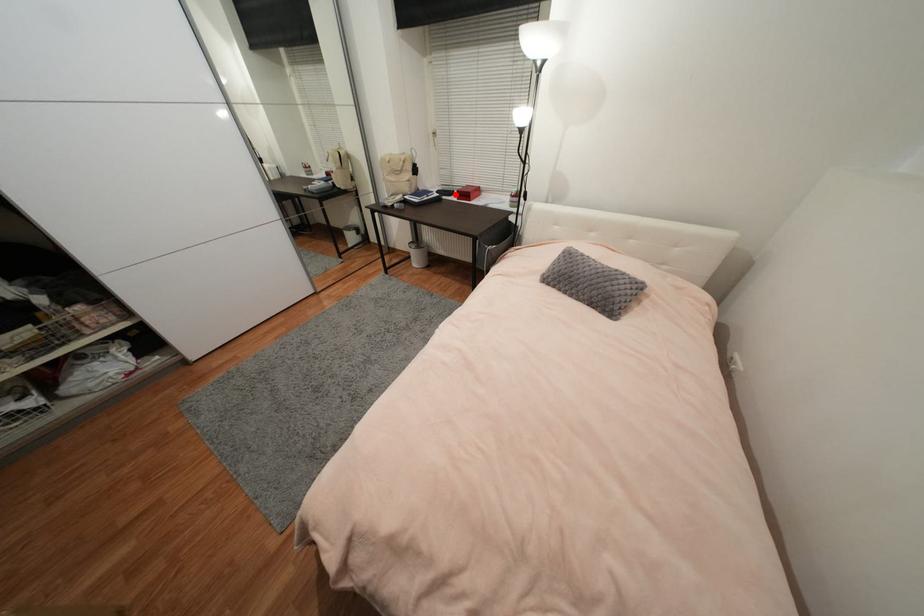
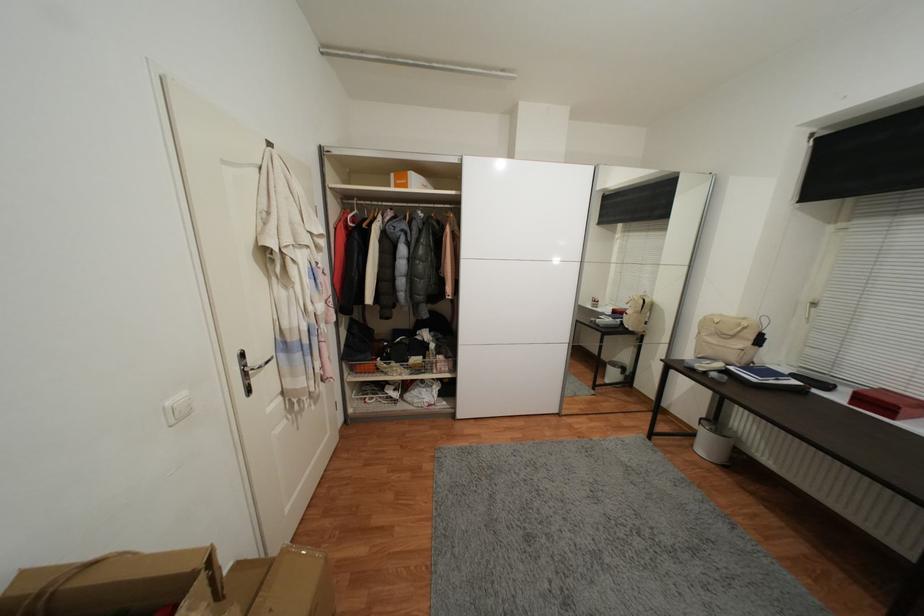
Find the pixel in the second image that matches the highlighted location in the first image.

(831, 387)